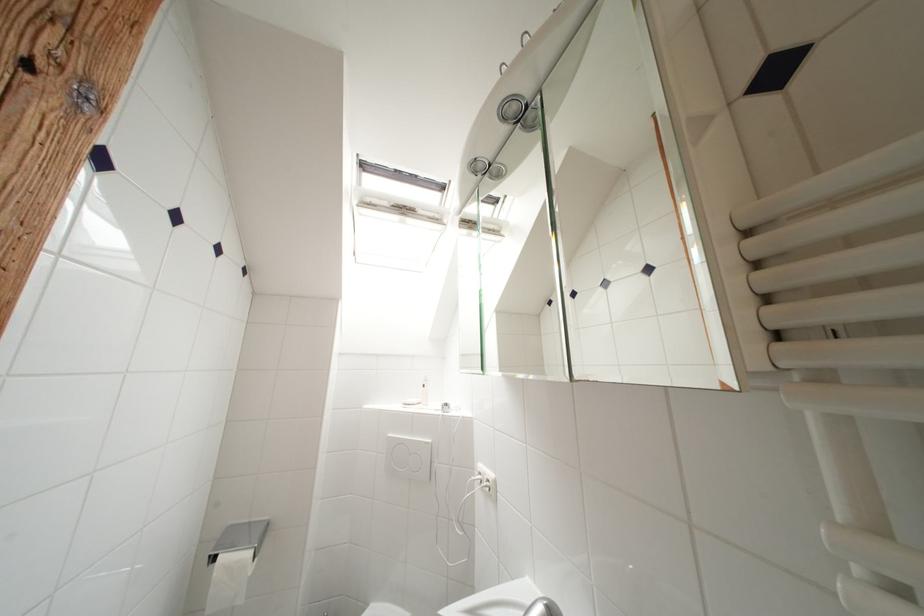
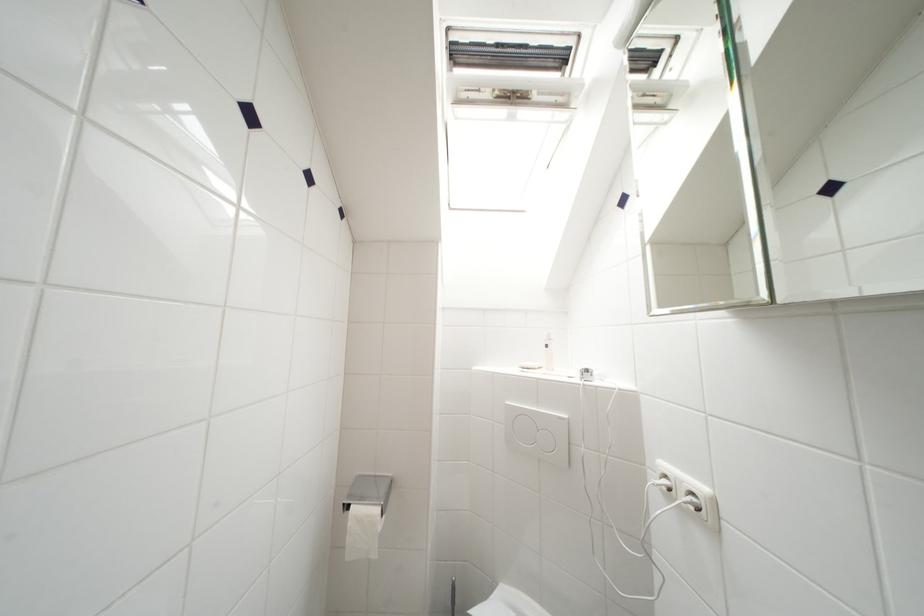
Question: The camera is either moving clockwise (left) or counter-clockwise (right) around the object. The first image is from the beginning of the video and the second image is from the end. Is the camera moving left or right when shooting the video?

Choices:
 (A) Left
 (B) Right

Answer: (B)